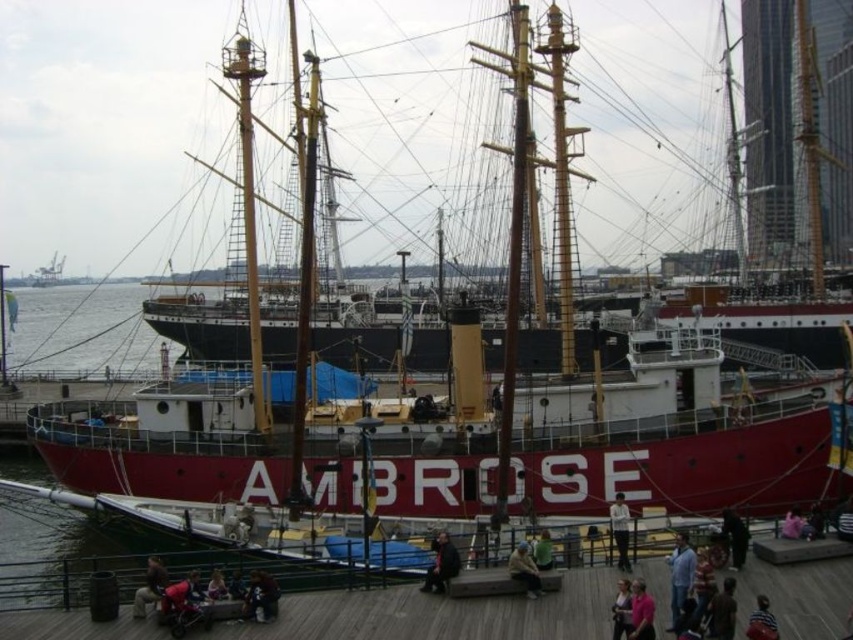
Can you confirm if dark gray fabric jacket at lower right is taller than dark blue jeans at lower center?

Incorrect, dark gray fabric jacket at lower right's height is not larger of dark blue jeans at lower center's.

Does point (728, 586) lie behind point (271, 602)?

That is False.

Identify the location of dark gray fabric jacket at lower right. (722, 611).

At what (x,y) coordinates should I click in order to perform the action: click on dark gray fabric jacket at lower right. Please return your answer as a coordinate pair (x, y). Looking at the image, I should click on (722, 611).

Where is `dark blue jeans at lower center`? This screenshot has height=640, width=853. dark blue jeans at lower center is located at coordinates (260, 596).

Can you confirm if dark blue jeans at lower center is thinner than pink fabric at lower right?

No.

The height and width of the screenshot is (640, 853). I want to click on dark blue jeans at lower center, so click(260, 596).

Who is more forward, (520, 561) or (759, 618)?

Point (759, 618)

Does light brown leather jacket at lower center have a greater height compared to striped shirt at lower right?

Yes.

Who is more distant from viewer, (x=520, y=552) or (x=766, y=618)?

Point (x=520, y=552)

Locate an element on the screen. Image resolution: width=853 pixels, height=640 pixels. light brown leather jacket at lower center is located at coordinates (524, 570).